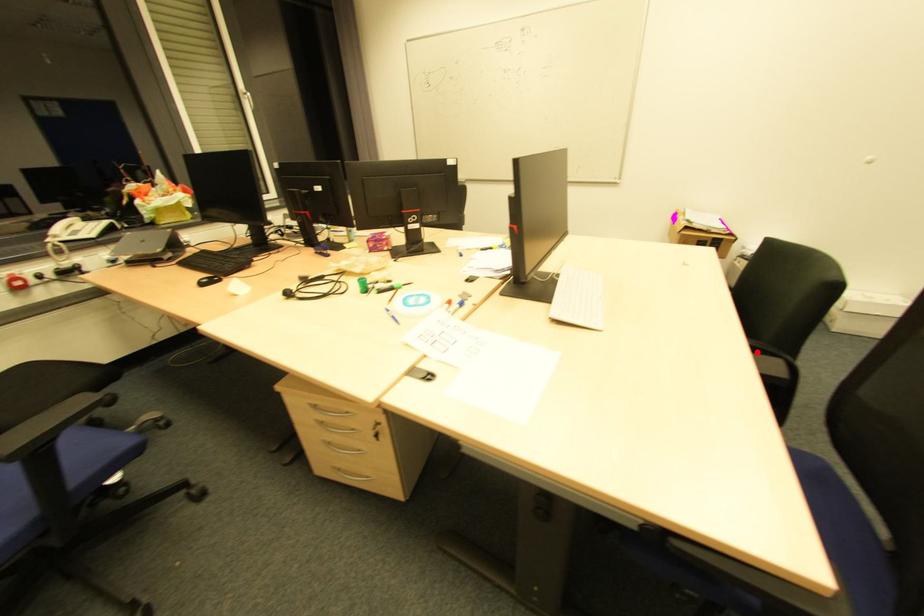
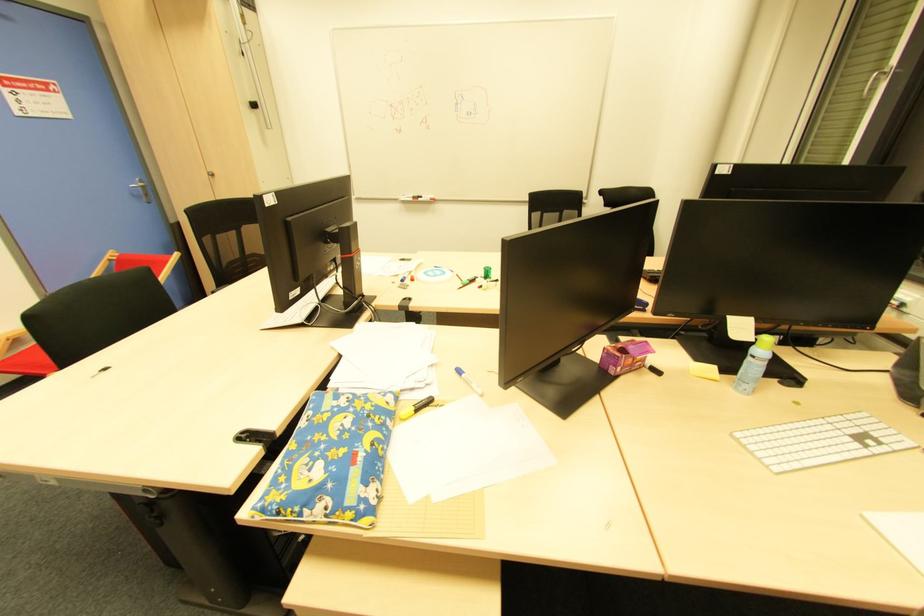
Question: I am providing you with two images of the same scene from different viewpoints. A red point is marked on the first image. Is the red point's position out of view in image 2?

Choices:
 (A) Yes
 (B) No

Answer: (A)